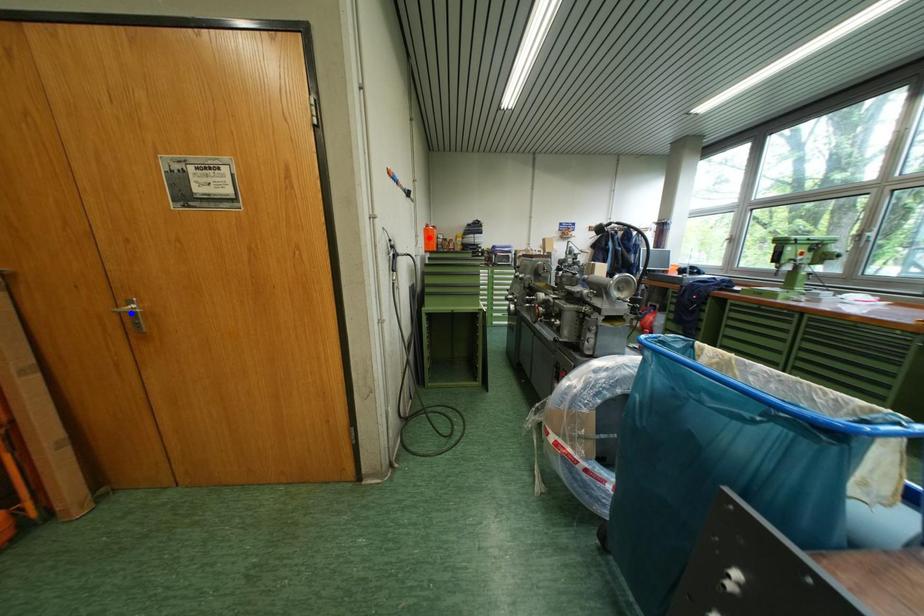
Question: In the image, two points are highlighted. Which point is nearer to the camera? Reply with the corresponding letter.

Choices:
 (A) blue point
 (B) red point

Answer: (A)